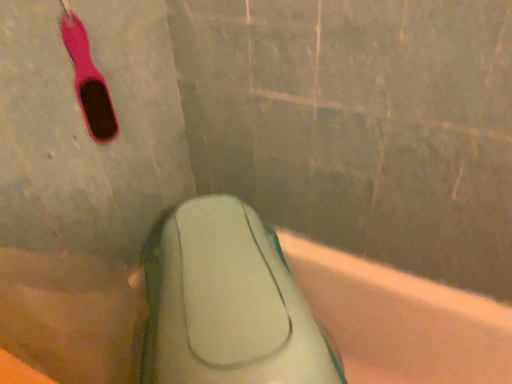
Question: Would you say green rubber sponge at lower center is inside or outside pink rubber toothbrush at upper left?

Choices:
 (A) inside
 (B) outside

Answer: (B)

Question: From the image's perspective, is green rubber sponge at lower center located above or below pink rubber toothbrush at upper left?

Choices:
 (A) below
 (B) above

Answer: (A)

Question: Is point (69, 304) positioned closer to the camera than point (96, 119)?

Choices:
 (A) closer
 (B) farther

Answer: (A)

Question: Considering the positions of point (104, 114) and point (397, 299), is point (104, 114) closer or farther from the camera than point (397, 299)?

Choices:
 (A) closer
 (B) farther

Answer: (A)

Question: Is pink rubber toothbrush at upper left bigger or smaller than green rubber sponge at lower center?

Choices:
 (A) small
 (B) big

Answer: (A)

Question: In terms of width, does pink rubber toothbrush at upper left look wider or thinner when compared to green rubber sponge at lower center?

Choices:
 (A) thin
 (B) wide

Answer: (A)

Question: Would you say pink rubber toothbrush at upper left is to the left or to the right of green rubber sponge at lower center in the picture?

Choices:
 (A) left
 (B) right

Answer: (A)